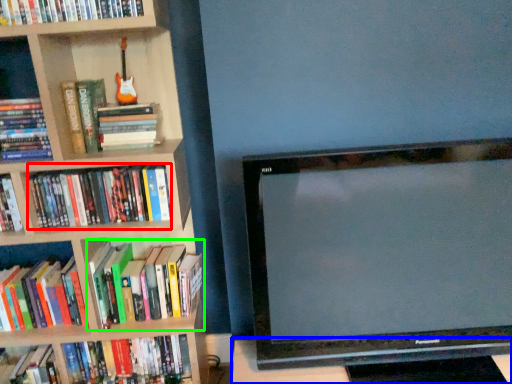
Question: Which object is positioned closest to book (highlighted by a red box)? Select from table (highlighted by a blue box) and book (highlighted by a green box).

Choices:
 (A) table
 (B) book

Answer: (B)